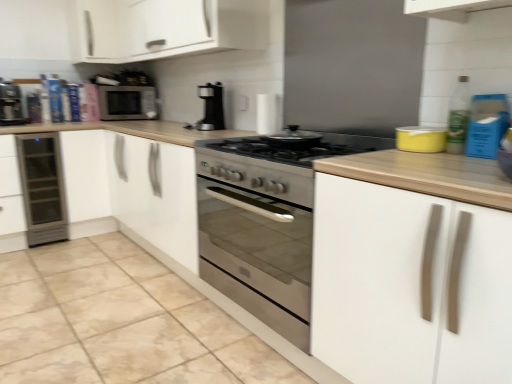
This screenshot has width=512, height=384. Identify the location of free space in front of green plastic bottle at upper right. (463, 163).